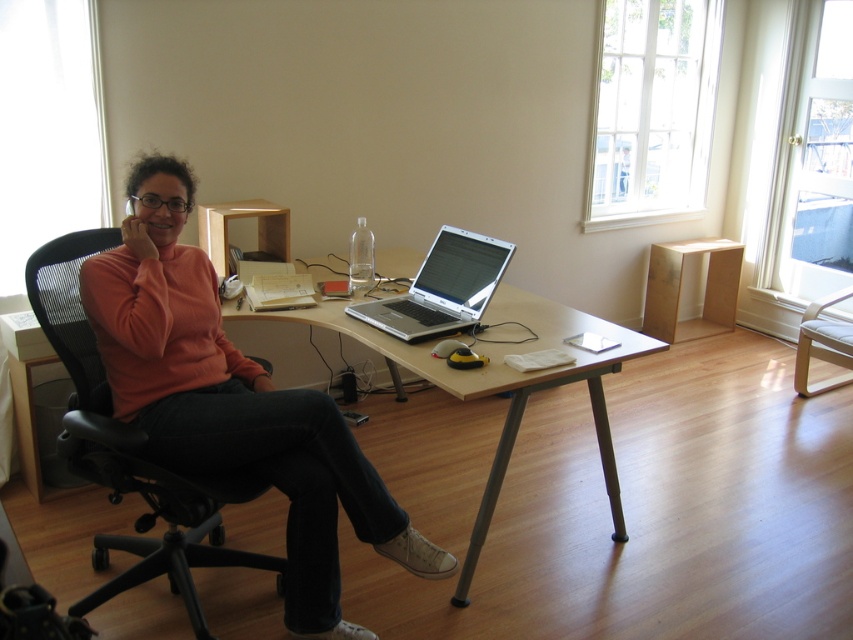
You are standing in the workspace and see the point at coordinates (233, 403). Based on the scene description, what object is this point located on?

The point at coordinates (233, 403) is located on the matte orange sweater at center.

You are a visitor entering the room and want to sit down in the black leather swivel chair at center. Which side of the silver metallic table at center should you approach to find the chair?

The black leather swivel chair at center is to the right of the silver metallic table at center, so you should approach the right side of the silver metallic table at center to find the chair.